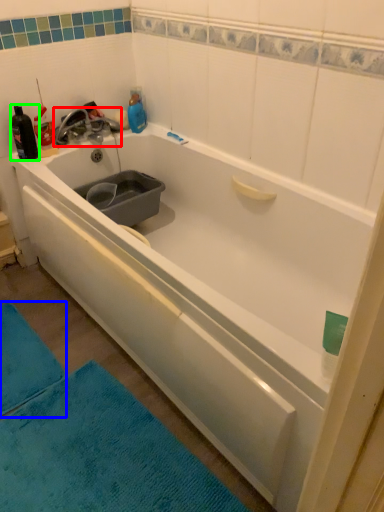
Question: Based on their relative distances, which object is nearer to tap (highlighted by a red box)? Choose from bath mat (highlighted by a blue box) and bottle (highlighted by a green box).

Choices:
 (A) bath mat
 (B) bottle

Answer: (B)